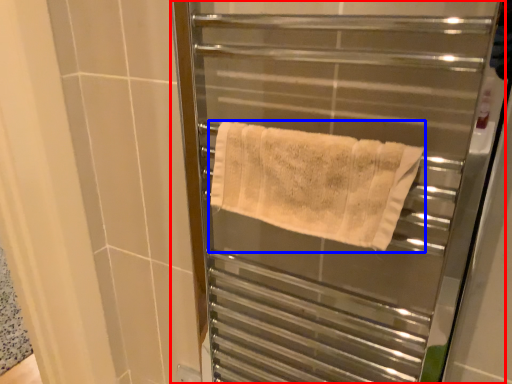
Question: Which object appears farthest to the camera in this image, screen door (highlighted by a red box) or towel (highlighted by a blue box)?

Choices:
 (A) screen door
 (B) towel

Answer: (B)